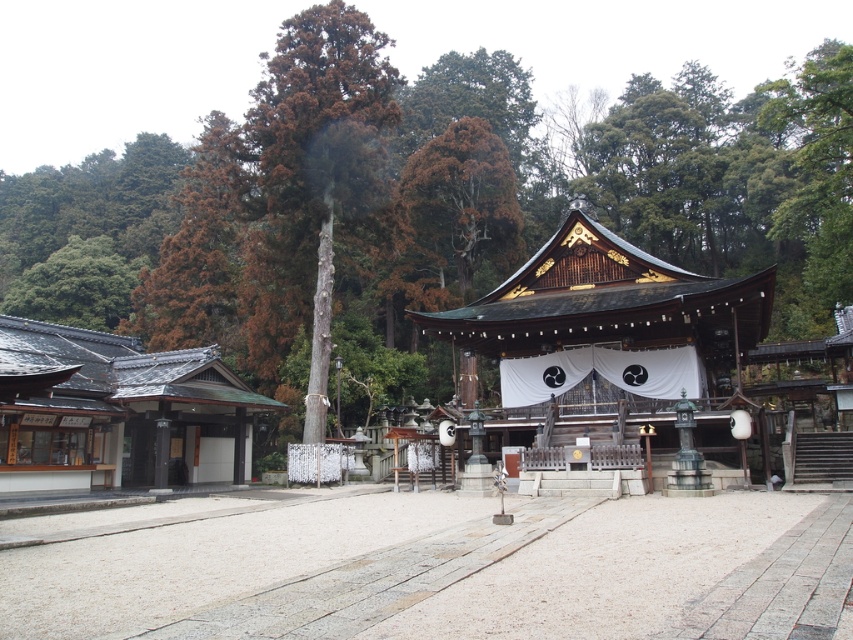
Who is more distant from viewer, (759, 166) or (624, 387)?

The point (759, 166) is behind.

Which of these two, brown wood tree at center or wooden shrine at center, stands taller?

Standing taller between the two is brown wood tree at center.

Where is `brown wood tree at center`? brown wood tree at center is located at coordinates (432, 200).